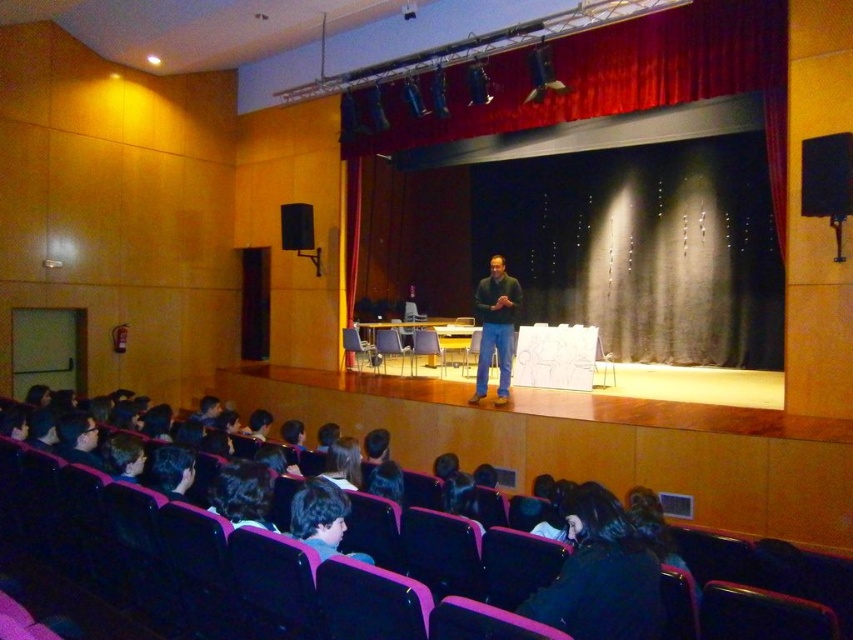
You are sitting in the front row of the auditorium and notice two items in your line of sight. The first is the black fabric at lower center and the second is the dark green sweater at center. Which of these items appears narrower from your perspective?

The black fabric at lower center appears narrower because its width is less than that of the dark green sweater at center.

You are an attendee sitting in the front row of the auditorium. You notice a black fabric at lower center. Can you estimate its location using coordinates? Please provide the coordinates if possible.

The black fabric at lower center is located at coordinates point (601, 573).

In the scene shown: You are a stagehand who needs to adjust the distance between the red velvet curtain at upper center and the black fabric at lower center to exactly 6 meters for a performance. Currently, they are 6.53 meters apart. What should you do?

The red velvet curtain at upper center is currently 6.53 meters from the black fabric at lower center. To reduce the distance to 6 meters, you should move the red velvet curtain at upper center closer to the black fabric at lower center by 0.53 meters.